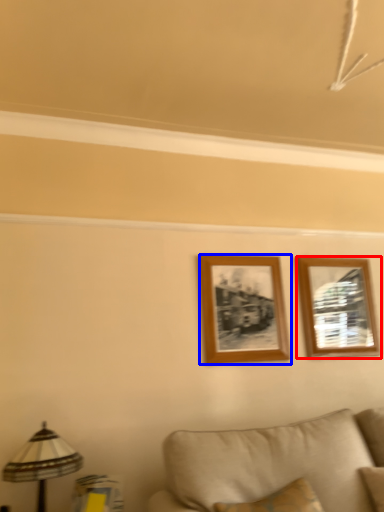
Question: Which object is closer to the camera taking this photo, picture frame (highlighted by a red box) or picture frame (highlighted by a blue box)?

Choices:
 (A) picture frame
 (B) picture frame

Answer: (B)